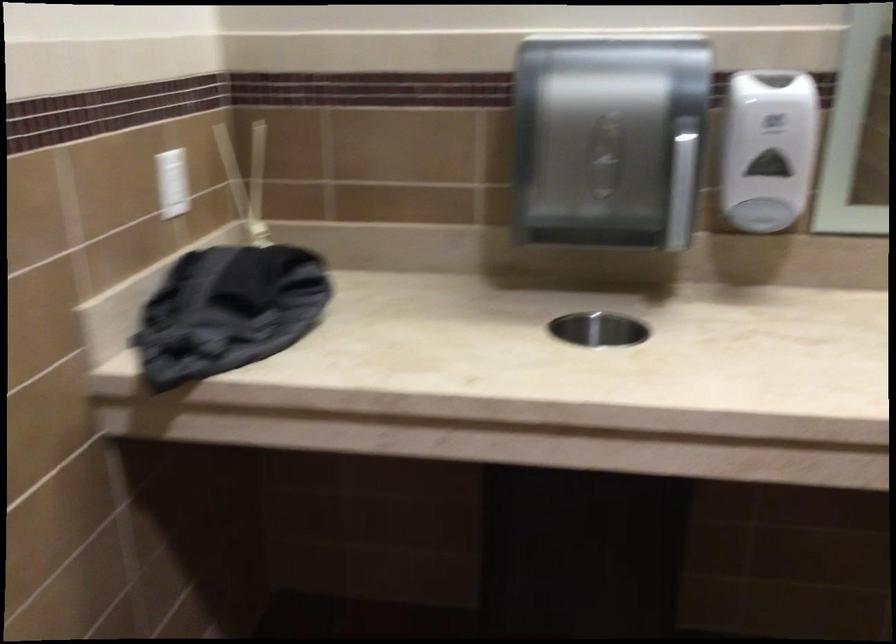
Describe the element at coordinates (762, 214) in the screenshot. I see `the soap dispenser button` at that location.